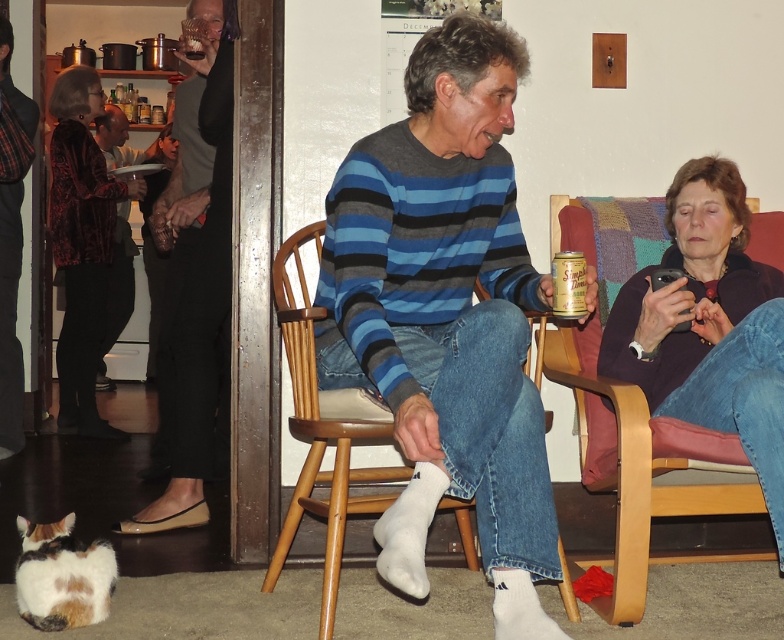
Question: Estimate the real-world distances between objects in this image. Which object is farther from the dark gray flannel shirt at left?

Choices:
 (A) printed velvet blouse at left
 (B) shiny black shoes at lower left
 (C) matte black sweater at left
 (D) purple soft sweater at right

Answer: (D)

Question: Which object appears closest to the camera in this image?

Choices:
 (A) matte black sweater at left
 (B) blue striped sweater at center
 (C) purple soft sweater at right
 (D) dark gray flannel shirt at left

Answer: (B)

Question: Is printed velvet blouse at left closer to camera compared to calico fur cat at lower left?

Choices:
 (A) yes
 (B) no

Answer: (B)

Question: Which object appears farthest from the camera in this image?

Choices:
 (A) gold foil can at center
 (B) dark gray flannel shirt at left
 (C) printed velvet blouse at left

Answer: (C)

Question: Can you confirm if dark gray flannel shirt at left is positioned below matte black sweater at left?

Choices:
 (A) no
 (B) yes

Answer: (B)

Question: Can you confirm if shiny black shoes at lower left is positioned to the left of printed velvet blouse at left?

Choices:
 (A) yes
 (B) no

Answer: (B)